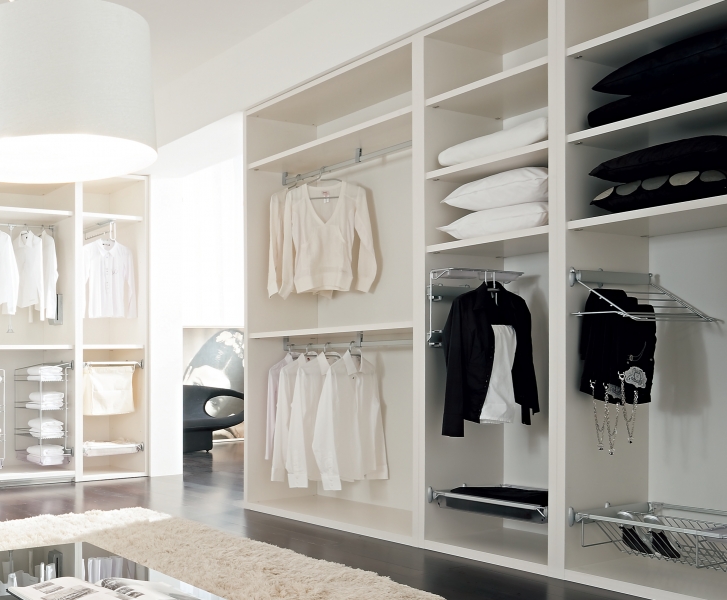
This screenshot has height=600, width=727. Find the location of `large white modern closets`. large white modern closets is located at coordinates (421, 244), (80, 338).